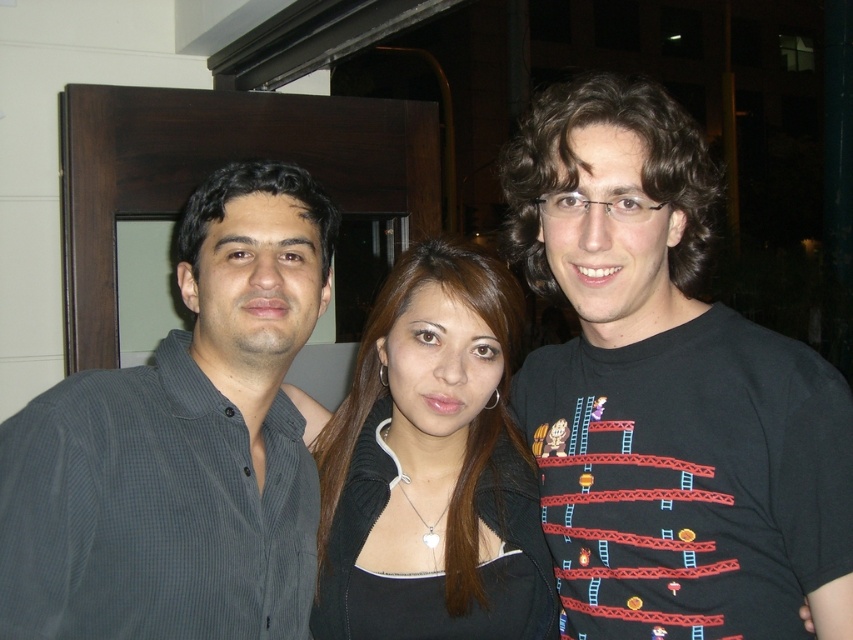
Question: Is the position of dark gray corduroy shirt at left more distant than that of black matte jacket at center?

Choices:
 (A) no
 (B) yes

Answer: (A)

Question: Is black cotton t-shirt at center smaller than dark gray corduroy shirt at left?

Choices:
 (A) yes
 (B) no

Answer: (B)

Question: Can you confirm if black cotton t-shirt at center is smaller than dark gray corduroy shirt at left?

Choices:
 (A) yes
 (B) no

Answer: (B)

Question: Which of the following is the closest to the observer?

Choices:
 (A) [x=468, y=342]
 (B) [x=599, y=484]

Answer: (B)

Question: Among these points, which one is farthest from the camera?

Choices:
 (A) (492, 579)
 (B) (47, 452)
 (C) (637, 541)

Answer: (A)

Question: Which point is closer to the camera?

Choices:
 (A) (840, 582)
 (B) (344, 520)
 (C) (297, 476)

Answer: (A)